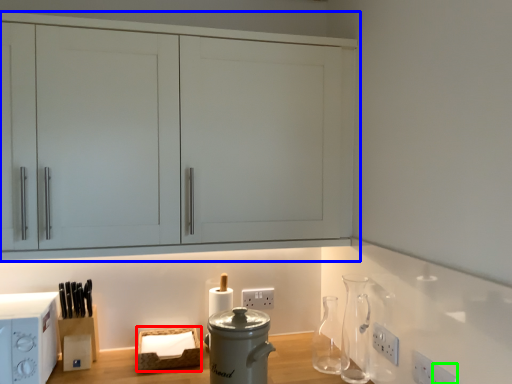
Question: Considering the real-world distances, which object is closest to basket (highlighted by a red box)? cabinetry (highlighted by a blue box) or electric outlet (highlighted by a green box).

Choices:
 (A) cabinetry
 (B) electric outlet

Answer: (A)